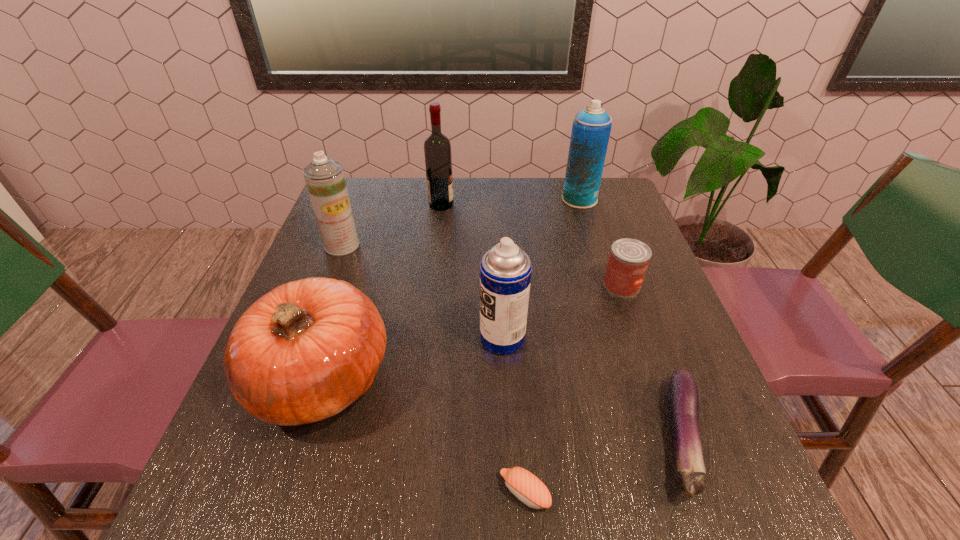
Identify the location of free area in between the second shortest object and the second aerosol can from left to right. This screenshot has width=960, height=540. (591, 388).

At what (x,y) coordinates should I click in order to perform the action: click on vacant point located between the second nearest aerosol can and the sixth object from right to left. Please return your answer as a coordinate pair (x, y). Looking at the image, I should click on (392, 225).

Where is `empty space that is in between the third object from left to right and the second aerosol can from left to right`? The width and height of the screenshot is (960, 540). empty space that is in between the third object from left to right and the second aerosol can from left to right is located at coordinates pos(471,271).

In order to click on free space between the sushi and the sixth object from right to left in this screenshot , I will do `click(483, 349)`.

Locate which object ranks fourth in proximity to the shortest object. Please provide its 2D coordinates. Your answer should be formatted as a tuple, i.e. [(x, y)], where the tuple contains the x and y coordinates of a point satisfying the conditions above.

[(628, 261)]

The width and height of the screenshot is (960, 540). In order to click on the seventh closest object to the eggplant in this screenshot , I will do `click(324, 177)`.

The height and width of the screenshot is (540, 960). I want to click on aerosol can that is the closest to the leftmost aerosol can, so click(x=505, y=271).

Point out which aerosol can is positioned as the nearest to the fourth shortest object. Please provide its 2D coordinates. Your answer should be formatted as a tuple, i.e. [(x, y)], where the tuple contains the x and y coordinates of a point satisfying the conditions above.

[(505, 271)]

In order to click on free space that satisfies the following two spatial constraints: 1. on the back side of the rightmost aerosol can; 2. on the right side of the second nearest aerosol can in this screenshot , I will do `click(359, 199)`.

Where is `vacant position in the image that satisfies the following two spatial constraints: 1. on the back side of the fourth farthest object; 2. on the front and back of the third object from left to right`? The width and height of the screenshot is (960, 540). vacant position in the image that satisfies the following two spatial constraints: 1. on the back side of the fourth farthest object; 2. on the front and back of the third object from left to right is located at coordinates (593, 205).